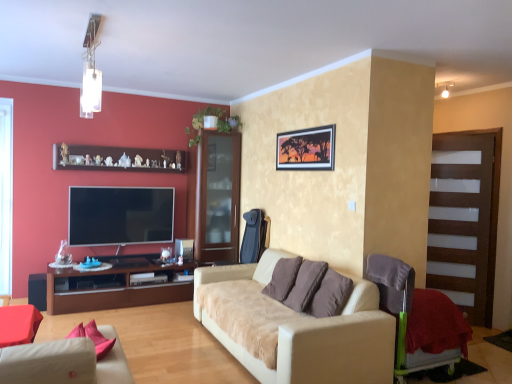
Question: Is brown fabric pillow at center far from brown glass cabinet at center?

Choices:
 (A) no
 (B) yes

Answer: (B)

Question: Considering the relative positions of brown fabric pillow at center and brown glass cabinet at center in the image provided, is brown fabric pillow at center behind brown glass cabinet at center?

Choices:
 (A) yes
 (B) no

Answer: (B)

Question: From the image's perspective, would you say brown fabric pillow at center is shown under brown glass cabinet at center?

Choices:
 (A) yes
 (B) no

Answer: (A)

Question: Is brown fabric pillow at center to the left of brown glass cabinet at center from the viewer's perspective?

Choices:
 (A) no
 (B) yes

Answer: (A)

Question: Does brown fabric pillow at center appear on the right side of brown glass cabinet at center?

Choices:
 (A) yes
 (B) no

Answer: (A)

Question: Does brown fabric pillow at center have a lesser height compared to brown glass cabinet at center?

Choices:
 (A) yes
 (B) no

Answer: (A)

Question: Could you tell me if wooden shelf at upper center is facing brown wood cabinet at left?

Choices:
 (A) yes
 (B) no

Answer: (B)

Question: Does wooden shelf at upper center have a greater height compared to brown wood cabinet at left?

Choices:
 (A) yes
 (B) no

Answer: (B)

Question: Is wooden shelf at upper center positioned before brown wood cabinet at left?

Choices:
 (A) yes
 (B) no

Answer: (B)

Question: Does wooden shelf at upper center lie behind brown wood cabinet at left?

Choices:
 (A) no
 (B) yes

Answer: (B)

Question: From the image's perspective, is wooden shelf at upper center located beneath brown wood cabinet at left?

Choices:
 (A) no
 (B) yes

Answer: (A)

Question: From a real-world perspective, does wooden shelf at upper center sit lower than brown wood cabinet at left?

Choices:
 (A) no
 (B) yes

Answer: (A)

Question: Does flat screen tv at left appear on the left side of red textured blanket at lower right?

Choices:
 (A) yes
 (B) no

Answer: (A)